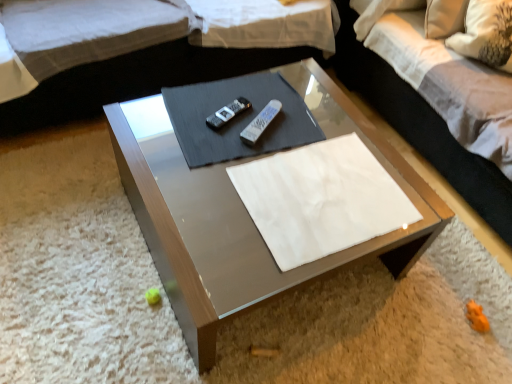
The image size is (512, 384). Identify the location of vacant space to the left of white plastic remote at center, acting as the 1th remote starting from the right. (212, 118).